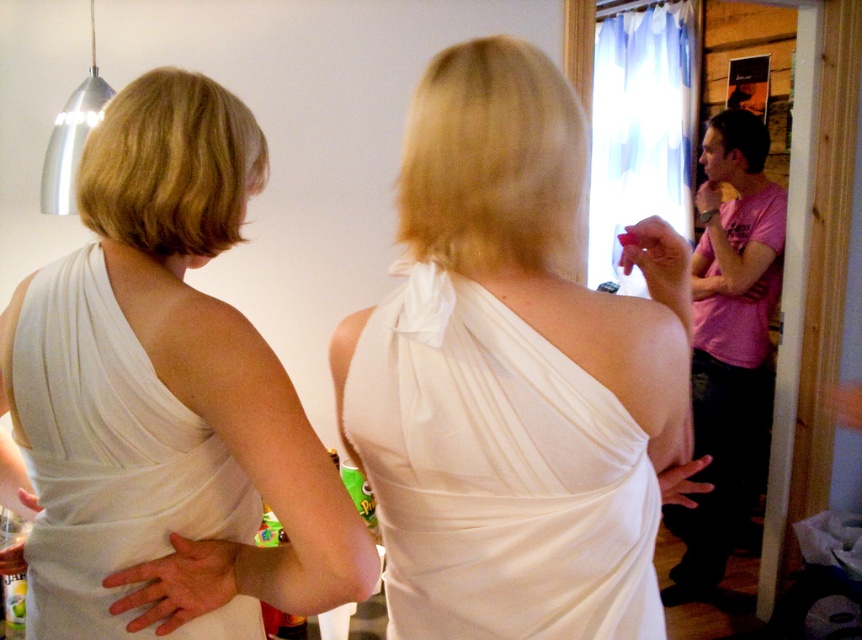
You are a photographer trying to capture the best shot of the scene. You need to focus on the white satin dress at center and the white fabric dress at upper left. Which dress should you adjust your camera angle upwards to include in your shot?

You should adjust your camera angle upwards to include the white satin dress at center because it is positioned above the white fabric dress at upper left.

You are a photographer trying to capture a clear shot of both the white fabric dress at upper left and the white fabric dress at back. Since they are both white, you need to adjust your camera to focus on their positions. Which dress should you focus on first to ensure the one closer to the camera is sharp?

The white fabric dress at upper left is in front of the white fabric dress at back, so you should focus on the white fabric dress at upper left first to ensure it is sharp since it is closer to the camera.